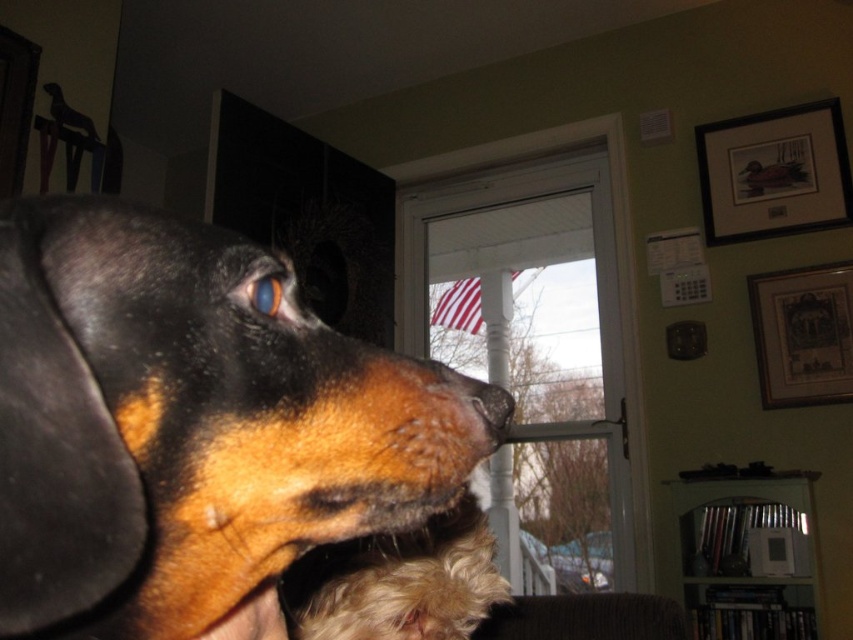
You are a photographer trying to capture the dog in the image. You need to decide which object, the black matte nose at center or the blue glossy eye at upper center, would be better to focus on to ensure sharpness, considering their sizes. Which one should you choose?

The black matte nose at center has a larger size compared to the blue glossy eye at upper center, so focusing on the black matte nose at center would be better to ensure sharpness due to its larger surface area.

You are standing 2 meters away from the dog. The point at coordinates point (537,289) is located on the dog. Can you reach this point with a 1.5 meter long stick?

The distance of point (537,289) from camera is 3.16 meters. Since you are standing 2 meters away from the dog, the total distance between you and the point is 2 meters plus the distance from the dog to the point. However, the given distance of 3.16 meters is already from the camera to the point, which includes your distance to the dog. Therefore, the stick of 1.5 meters is shorter than the required 3.16 meters, so you cannot reach the point with the stick.